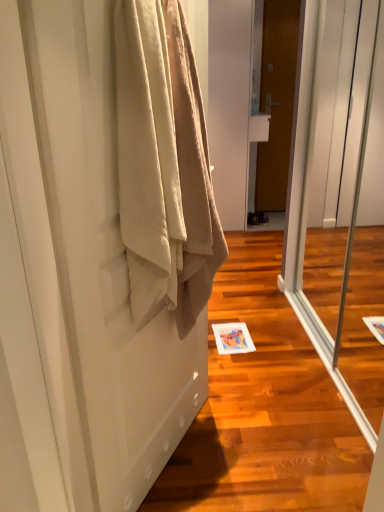
What do you see at coordinates (76, 281) in the screenshot? This screenshot has width=384, height=512. I see `beige fabric door at left, which appears as the second door when viewed from the back` at bounding box center [76, 281].

Find the location of a particular element. This screenshot has width=384, height=512. beige fabric door at left, the 2th door positioned from the top is located at coordinates (76, 281).

This screenshot has height=512, width=384. Describe the element at coordinates (277, 101) in the screenshot. I see `brown wooden door at center, which is the second door from left to right` at that location.

Describe the element at coordinates (342, 202) in the screenshot. I see `transparent glass screen door at center` at that location.

At what (x,y) coordinates should I click in order to perform the action: click on beige fabric door at left, the 2th door positioned from the top. Please return your answer as a coordinate pair (x, y). This screenshot has height=512, width=384. Looking at the image, I should click on (76, 281).

Is brown wooden door at center, which is counted as the 1th door, starting from the top, bigger than beige fabric door at left, which is the first door in left-to-right order?

Actually, brown wooden door at center, which is counted as the 1th door, starting from the top, might be smaller than beige fabric door at left, which is the first door in left-to-right order.

Which object is positioned more to the left, brown wooden door at center, the 1th door viewed from the back, or beige fabric door at left, the 2th door positioned from the top?

beige fabric door at left, the 2th door positioned from the top, is more to the left.

Which object is further away from the camera taking this photo, brown wooden door at center, which is the second door from left to right, or beige fabric door at left, the 2th door positioned from the top?

brown wooden door at center, which is the second door from left to right, is more distant.

From a real-world perspective, which object stands above the other?

From a 3D spatial view, brown wooden door at center, which is the second door from left to right, is above.

Is transparent glass screen door at center positioned far away from beige textured towel at left?

Absolutely, transparent glass screen door at center is distant from beige textured towel at left.

What's the angular difference between transparent glass screen door at center and beige textured towel at left's facing directions?

The angle between the facing direction of transparent glass screen door at center and the facing direction of beige textured towel at left is 147 degrees.

Does transparent glass screen door at center come in front of beige textured towel at left?

That is False.

Which object is positioned more to the left, transparent glass screen door at center or beige textured towel at left?

beige textured towel at left is more to the left.

Considering the points (88, 326) and (138, 166), which point is behind, point (88, 326) or point (138, 166)?

Point (88, 326)

Is beige fabric door at left, which is counted as the first door, starting from the bottom, smaller than beige textured towel at left?

Incorrect, beige fabric door at left, which is counted as the first door, starting from the bottom, is not smaller in size than beige textured towel at left.

From the image's perspective, which is below, beige fabric door at left, which appears as the second door when viewed from the back, or beige textured towel at left?

From the image's view, beige fabric door at left, which appears as the second door when viewed from the back, is below.

Which of these two, beige fabric door at left, which appears as the second door when viewed from the back, or brown wooden door at center, the second door ordered from the bottom, stands shorter?

beige fabric door at left, which appears as the second door when viewed from the back.

Is beige fabric door at left, which is counted as the first door, starting from the bottom, not near brown wooden door at center, positioned as the first door in right-to-left order?

Yes, beige fabric door at left, which is counted as the first door, starting from the bottom, and brown wooden door at center, positioned as the first door in right-to-left order, are located far from each other.

Considering the points (71, 494) and (287, 57), which point is behind, point (71, 494) or point (287, 57)?

The point (287, 57) is more distant.

Locate an element on the screen. The image size is (384, 512). door below the brown wooden door at center, which is counted as the 1th door, starting from the top (from the image's perspective) is located at coordinates (76, 281).

How many degrees apart are the facing directions of transparent glass screen door at center and beige fabric door at left, which appears as the second door when viewed from the back?

There is a 147-degree angle between the facing directions of transparent glass screen door at center and beige fabric door at left, which appears as the second door when viewed from the back.

Can you confirm if transparent glass screen door at center is positioned to the right of beige fabric door at left, placed as the second door when sorted from right to left?

Indeed, transparent glass screen door at center is positioned on the right side of beige fabric door at left, placed as the second door when sorted from right to left.

Which object is thinner, transparent glass screen door at center or beige fabric door at left, which appears as the second door when viewed from the back?

beige fabric door at left, which appears as the second door when viewed from the back.

Is transparent glass screen door at center oriented towards beige fabric door at left, which appears as the second door when viewed from the back?

Yes, transparent glass screen door at center is oriented towards beige fabric door at left, which appears as the second door when viewed from the back.

Considering the positions of point (155, 189) and point (285, 164), is point (155, 189) closer or farther from the camera than point (285, 164)?

Clearly, point (155, 189) is closer to the camera than point (285, 164).

Considering the sizes of objects beige textured towel at left and brown wooden door at center, the second door ordered from the bottom, in the image provided, who is wider, beige textured towel at left or brown wooden door at center, the second door ordered from the bottom,?

beige textured towel at left.

Which of these two, beige textured towel at left or brown wooden door at center, which is counted as the 1th door, starting from the top, stands shorter?

beige textured towel at left is shorter.

This screenshot has height=512, width=384. In order to click on screen door behind the beige fabric door at left, which appears as the second door when viewed from the back in this screenshot , I will do `click(342, 202)`.

How distant is beige fabric door at left, which is counted as the first door, starting from the bottom, from transparent glass screen door at center?

A distance of 1.56 meters exists between beige fabric door at left, which is counted as the first door, starting from the bottom, and transparent glass screen door at center.

Is point (122, 396) farther from camera compared to point (349, 407)?

No, (122, 396) is in front of (349, 407).

Is beige fabric door at left, placed as the second door when sorted from right to left, taller than transparent glass screen door at center?

Incorrect, the height of beige fabric door at left, placed as the second door when sorted from right to left, is not larger of that of transparent glass screen door at center.

This screenshot has height=512, width=384. I want to click on door that is on the right side of beige fabric door at left, which is counted as the first door, starting from the bottom, so click(277, 101).

I want to click on screen door above the beige textured towel at left (from the image's perspective), so click(x=342, y=202).

Which object lies further to the anchor point beige textured towel at left, brown wooden door at center, positioned as the first door in right-to-left order, or beige fabric door at left, the 2th door positioned from the top?

Based on the image, brown wooden door at center, positioned as the first door in right-to-left order, appears to be further to beige textured towel at left.

Based on their spatial positions, is beige fabric door at left, placed as the second door when sorted from right to left, or beige textured towel at left closer to transparent glass screen door at center?

beige fabric door at left, placed as the second door when sorted from right to left, is closer to transparent glass screen door at center.

From the image, which object appears to be farther from brown wooden door at center, which is counted as the 1th door, starting from the top, beige fabric door at left, which appears as the second door when viewed from the back, or beige textured towel at left?

Based on the image, beige fabric door at left, which appears as the second door when viewed from the back, appears to be further to brown wooden door at center, which is counted as the 1th door, starting from the top.

Looking at the image, which one is located closer to beige textured towel at left, beige fabric door at left, which is counted as the first door, starting from the bottom, or transparent glass screen door at center?

beige fabric door at left, which is counted as the first door, starting from the bottom, is positioned closer to the anchor beige textured towel at left.

Based on their spatial positions, is transparent glass screen door at center or brown wooden door at center, which is counted as the 1th door, starting from the top, further from beige textured towel at left?

Based on the image, brown wooden door at center, which is counted as the 1th door, starting from the top, appears to be further to beige textured towel at left.

Considering their positions, is beige fabric door at left, the 2th door positioned from the top, positioned closer to transparent glass screen door at center than brown wooden door at center, positioned as the first door in right-to-left order?

brown wooden door at center, positioned as the first door in right-to-left order.

When comparing their distances from transparent glass screen door at center, does brown wooden door at center, which is the second door from left to right, or beige textured towel at left seem closer?

brown wooden door at center, which is the second door from left to right, lies closer to transparent glass screen door at center than the other object.

Based on their spatial positions, is brown wooden door at center, which is the second door from left to right, or beige textured towel at left closer to beige fabric door at left, which is the first door in left-to-right order?

Based on the image, beige textured towel at left appears to be nearer to beige fabric door at left, which is the first door in left-to-right order.

What are the coordinates of `towel between beige fabric door at left, which is counted as the first door, starting from the bottom, and brown wooden door at center, which is counted as the 1th door, starting from the top, from front to back` in the screenshot? It's located at (164, 164).

Where is `screen door between beige fabric door at left, placed as the second door when sorted from right to left, and brown wooden door at center, the 1th door viewed from the back, from front to back`? screen door between beige fabric door at left, placed as the second door when sorted from right to left, and brown wooden door at center, the 1th door viewed from the back, from front to back is located at coordinates (342, 202).

This screenshot has width=384, height=512. In order to click on towel located between beige fabric door at left, which is counted as the first door, starting from the bottom, and transparent glass screen door at center in the left-right direction in this screenshot , I will do `click(164, 164)`.

Identify the location of screen door positioned between beige textured towel at left and brown wooden door at center, the 1th door viewed from the back, from near to far. (342, 202).